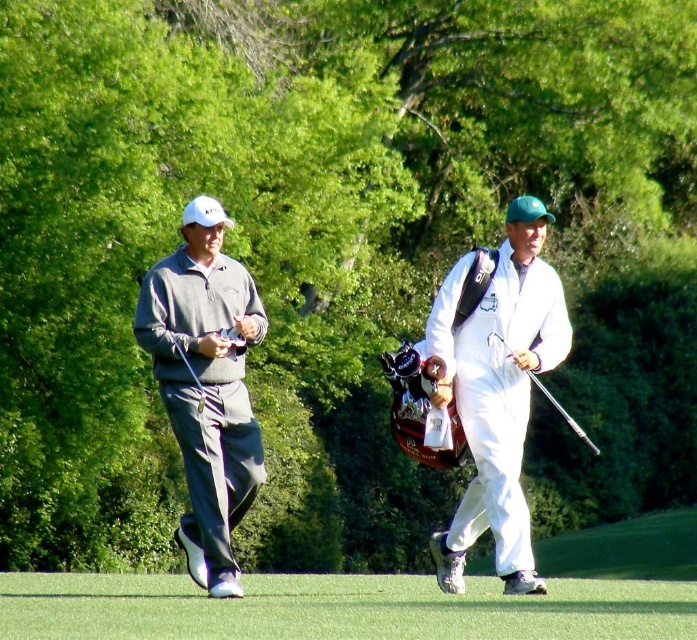
Is the position of matte gray sweater at left more distant than that of metallic silver golf club at right?

Yes, matte gray sweater at left is further from the viewer.

Is matte gray sweater at left taller than metallic silver golf club at right?

Yes, matte gray sweater at left is taller than metallic silver golf club at right.

Where is `matte gray sweater at left`? matte gray sweater at left is located at coordinates (206, 385).

The image size is (697, 640). What are the coordinates of `matte gray sweater at left` in the screenshot? It's located at (206, 385).

Between gray sweater at center and white matte golf bag at center, which one is positioned lower?

white matte golf bag at center

Is gray sweater at center wider than white matte golf bag at center?

Yes, gray sweater at center is wider than white matte golf bag at center.

Which is behind, point (489, 269) or point (454, 276)?

The point (454, 276) is behind.

You are a GUI agent. You are given a task and a screenshot of the screen. Output one action in this format:
    pyautogui.click(x=<x>, y=<y>)
    Task: Click on the gray sweater at center
    The height and width of the screenshot is (640, 697).
    Given the screenshot: What is the action you would take?
    pyautogui.click(x=493, y=387)

Who is lower down, green turf at lower center or metallic silver golf club at right?

green turf at lower center is below.

Does green turf at lower center appear over metallic silver golf club at right?

Actually, green turf at lower center is below metallic silver golf club at right.

Which is behind, point (45, 618) or point (551, 396)?

Positioned behind is point (551, 396).

At what (x,y) coordinates should I click in order to perform the action: click on green turf at lower center. Please return your answer as a coordinate pair (x, y). This screenshot has width=697, height=640. Looking at the image, I should click on (337, 609).